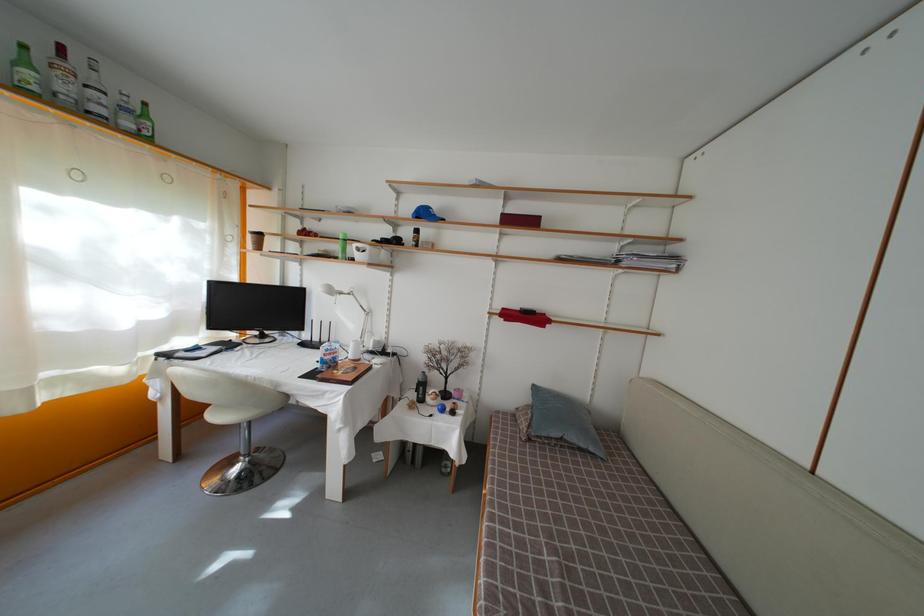
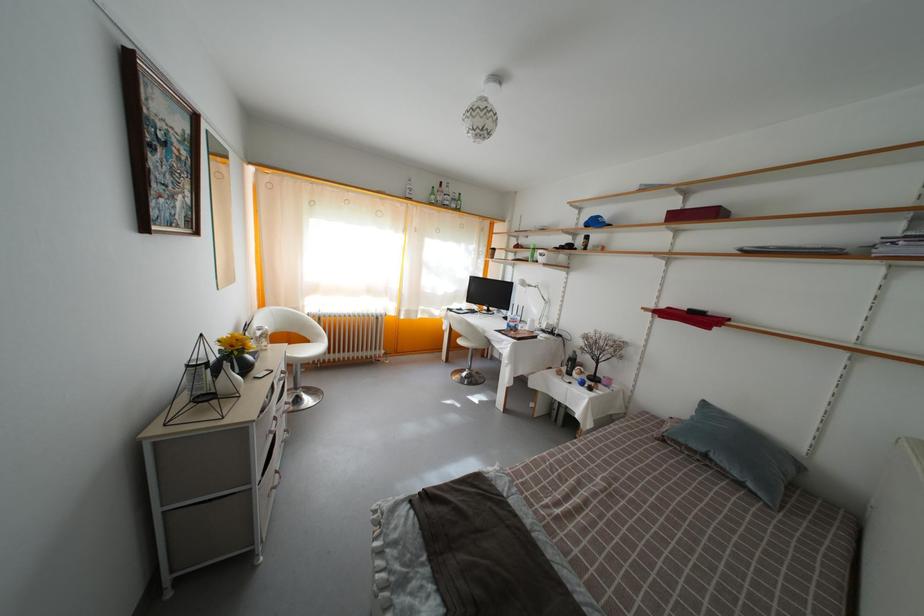
The point at (343, 294) is marked in the first image. Where is the corresponding point in the second image?

(533, 289)